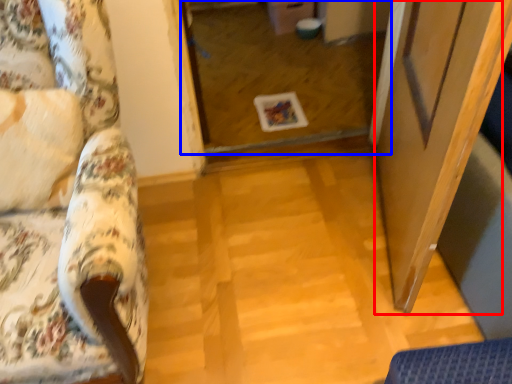
Question: Which point is closer to the camera, screen door (highlighted by a red box) or glass door (highlighted by a blue box)?

Choices:
 (A) screen door
 (B) glass door

Answer: (A)